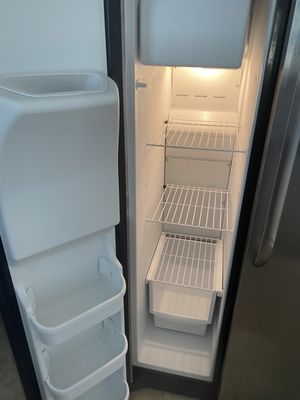
Identify the location of empty space top of fridge door. Image resolution: width=300 pixels, height=400 pixels. (54, 35).